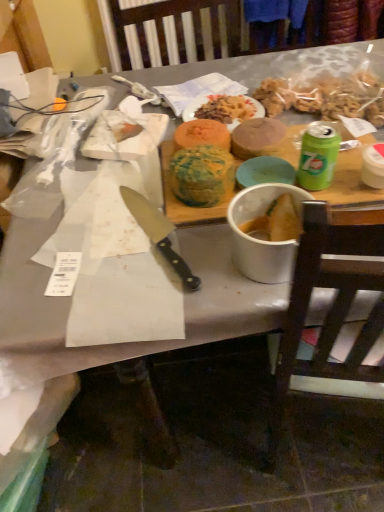
Find the location of a particular element. This screenshot has height=512, width=384. free spot to the right of black plastic knife at center is located at coordinates (217, 244).